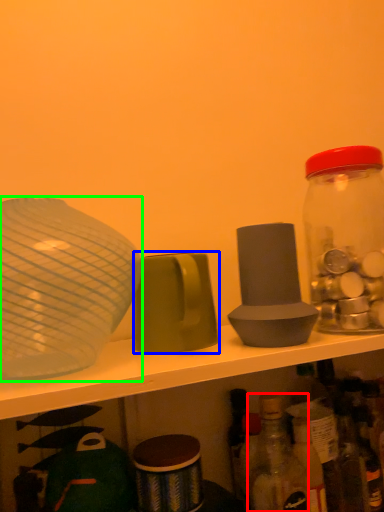
Question: Which object is the closest to the bottle (highlighted by a red box)? Choose among these: tableware (highlighted by a blue box) or tableware (highlighted by a green box).

Choices:
 (A) tableware
 (B) tableware

Answer: (A)